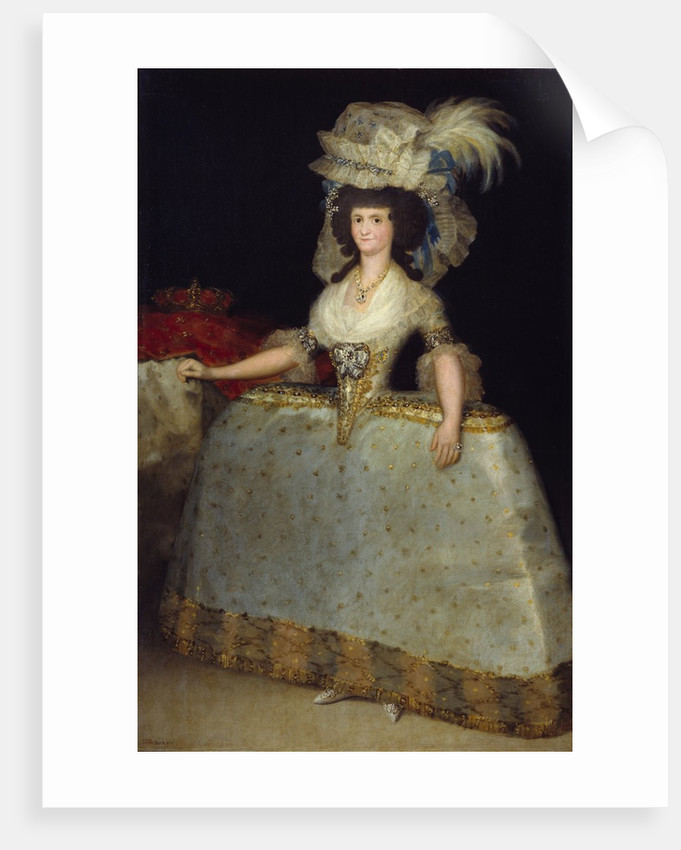
Image resolution: width=681 pixels, height=850 pixels. What are the coordinates of `pendant` in the screenshot? It's located at [x=361, y=297].